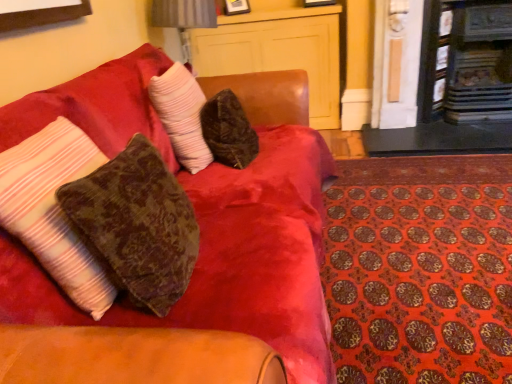
Question: From the image's perspective, would you say matte wood dresser at upper center is positioned over velvet brown pillow at center, the second pillow viewed from the back?

Choices:
 (A) no
 (B) yes

Answer: (B)

Question: Is matte wood dresser at upper center closer to the viewer compared to velvet brown pillow at center, the second pillow viewed from the back?

Choices:
 (A) yes
 (B) no

Answer: (B)

Question: Is matte wood dresser at upper center thinner than velvet brown pillow at center, the 2th pillow from the front?

Choices:
 (A) yes
 (B) no

Answer: (B)

Question: Is matte wood dresser at upper center positioned behind velvet brown pillow at center, the 2th pillow from the front?

Choices:
 (A) yes
 (B) no

Answer: (A)

Question: Can you confirm if matte wood dresser at upper center is smaller than velvet brown pillow at center, the 2th pillow from the front?

Choices:
 (A) no
 (B) yes

Answer: (A)

Question: Could velvet brown pillow at center, the 2th pillow from the front, be considered to be inside matte wood dresser at upper center?

Choices:
 (A) no
 (B) yes

Answer: (A)

Question: Considering the relative sizes of orange patterned mat at lower right and ruffled white pillow at center, which is counted as the first pillow, starting from the back, in the image provided, is orange patterned mat at lower right smaller than ruffled white pillow at center, which is counted as the first pillow, starting from the back,?

Choices:
 (A) yes
 (B) no

Answer: (B)

Question: Considering the relative sizes of orange patterned mat at lower right and ruffled white pillow at center, which is counted as the first pillow, starting from the back, in the image provided, is orange patterned mat at lower right thinner than ruffled white pillow at center, which is counted as the first pillow, starting from the back,?

Choices:
 (A) no
 (B) yes

Answer: (A)

Question: From the image's perspective, does orange patterned mat at lower right appear higher than ruffled white pillow at center, which is counted as the first pillow, starting from the back?

Choices:
 (A) yes
 (B) no

Answer: (B)

Question: Is orange patterned mat at lower right bigger than ruffled white pillow at center, which is counted as the first pillow, starting from the back?

Choices:
 (A) yes
 (B) no

Answer: (A)

Question: Is orange patterned mat at lower right further to camera compared to ruffled white pillow at center, which is counted as the first pillow, starting from the back?

Choices:
 (A) yes
 (B) no

Answer: (B)

Question: Is ruffled white pillow at center, which is counted as the first pillow, starting from the back, inside orange patterned mat at lower right?

Choices:
 (A) yes
 (B) no

Answer: (B)

Question: Is dark wood fireplace at upper right, the second fireplace from the right, to the right of matte wood dresser at upper center from the viewer's perspective?

Choices:
 (A) no
 (B) yes

Answer: (B)